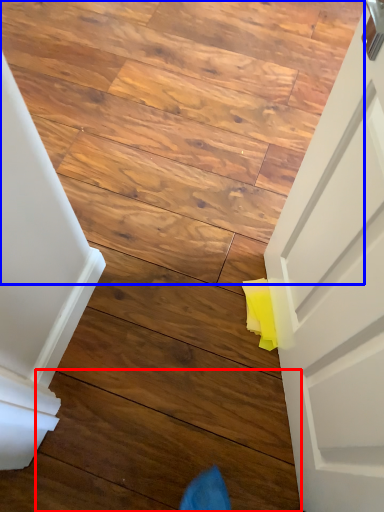
Question: Which point is further to the camera, plank (highlighted by a red box) or stairwell (highlighted by a blue box)?

Choices:
 (A) plank
 (B) stairwell

Answer: (B)